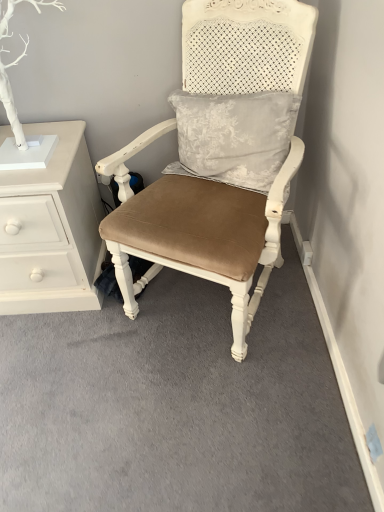
In order to click on vacant space in suede-like tan cushion at center (from a real-world perspective) in this screenshot , I will do `click(195, 302)`.